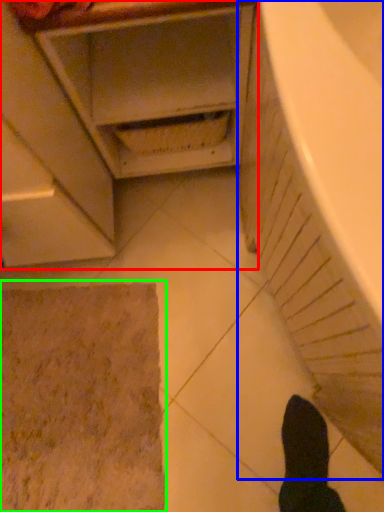
Question: Which is farther away from cabinetry (highlighted by a red box)? bath (highlighted by a blue box) or bath mat (highlighted by a green box)?

Choices:
 (A) bath
 (B) bath mat

Answer: (B)